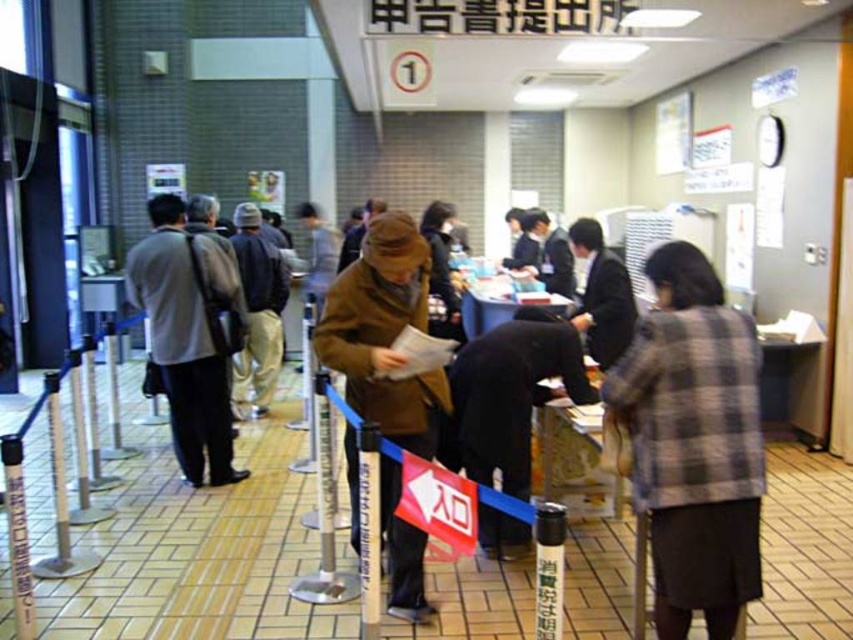
Question: Can you confirm if plaid fabric jacket at center is bigger than brown woolen coat at center?

Choices:
 (A) no
 (B) yes

Answer: (A)

Question: Does plaid fabric jacket at center have a smaller size compared to brown woolen coat at center?

Choices:
 (A) yes
 (B) no

Answer: (A)

Question: Which object appears closest to the camera in this image?

Choices:
 (A) plaid fabric jacket at center
 (B) brown woolen coat at center

Answer: (A)

Question: Is plaid fabric jacket at center positioned in front of brown woolen coat at center?

Choices:
 (A) yes
 (B) no

Answer: (A)